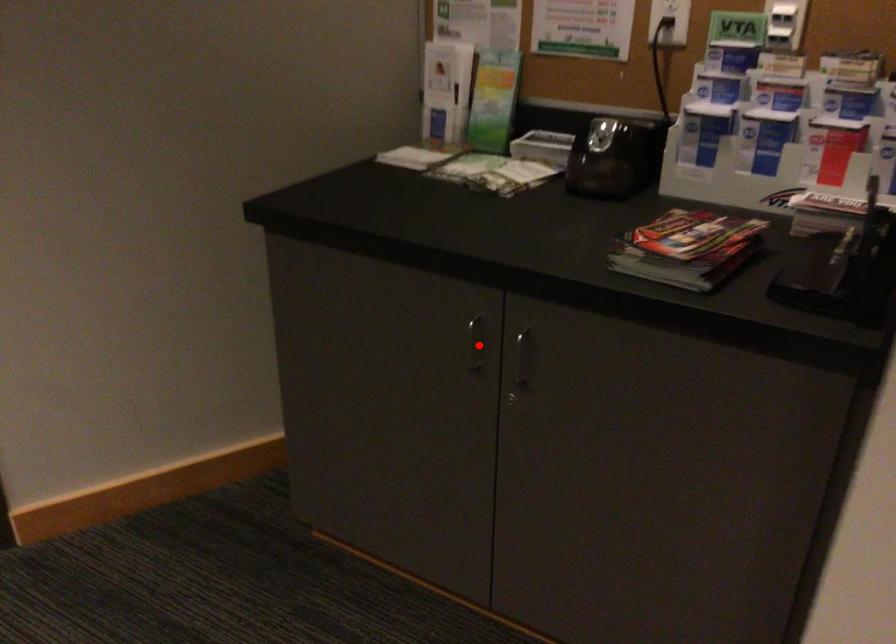
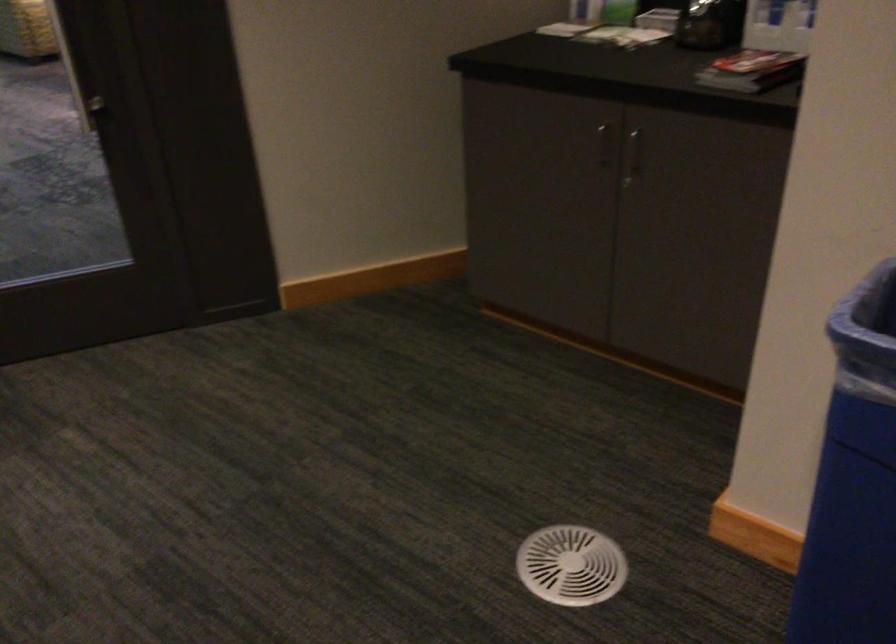
The point at the highlighted location is marked in the first image. Where is the corresponding point in the second image?

(604, 144)